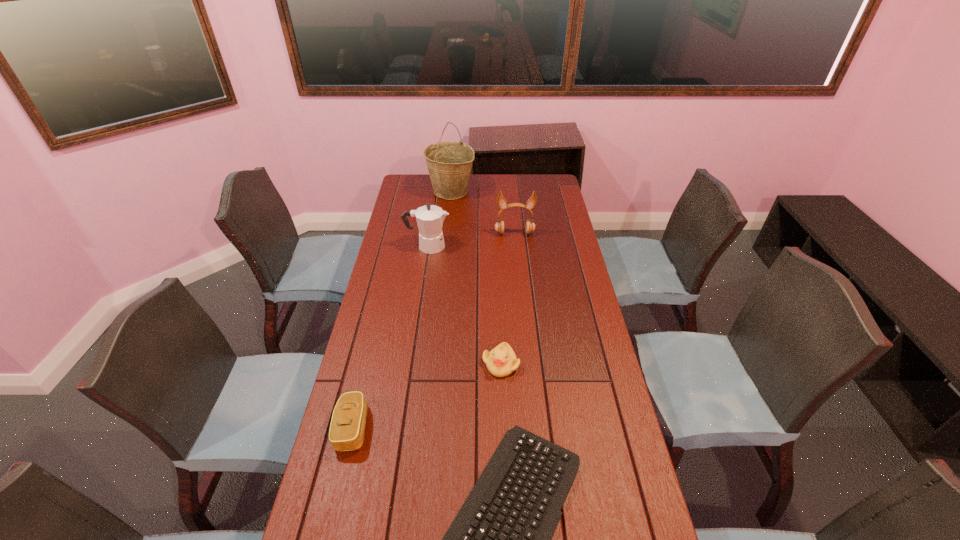
The height and width of the screenshot is (540, 960). I want to click on blank space that satisfies the following two spatial constraints: 1. on the front-facing side of the earphone; 2. at the spout of the coffeepot, so click(516, 246).

This screenshot has width=960, height=540. Identify the location of vacant area that satisfies the following two spatial constraints: 1. on the front-facing side of the earphone; 2. on the zipper side of the clutch bag. (535, 428).